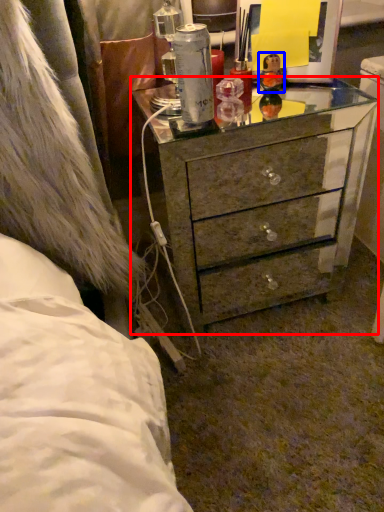
Question: Which point is further to the camera, chest of drawers (highlighted by a red box) or toy (highlighted by a blue box)?

Choices:
 (A) chest of drawers
 (B) toy

Answer: (B)